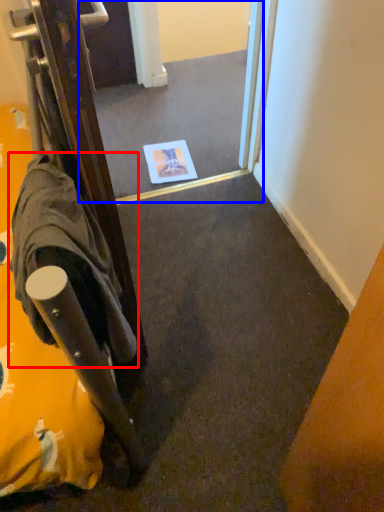
Question: Which of the following is the closest to the observer, robe (highlighted by a red box) or mirror (highlighted by a blue box)?

Choices:
 (A) robe
 (B) mirror

Answer: (A)